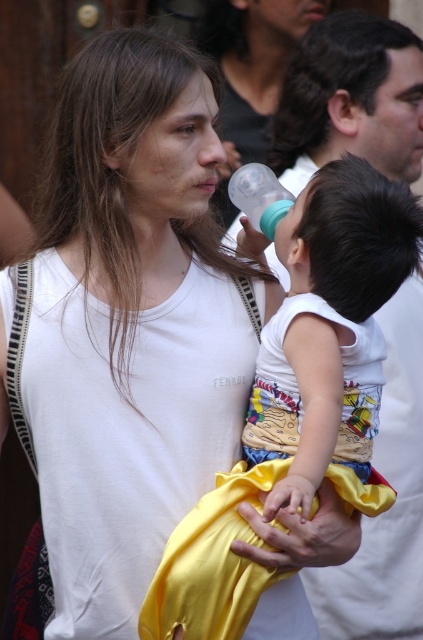
You are a photographer trying to capture a closeup of the brownhair at center and the dark brown hair at upper center. Which one will appear larger in your photo?

The brownhair at center will appear larger in the photo because it is closer to the viewer than the dark brown hair at upper center.

What are the coordinates of the smooth white shirt at center?

The smooth white shirt at center is located at coordinates point [351,99].